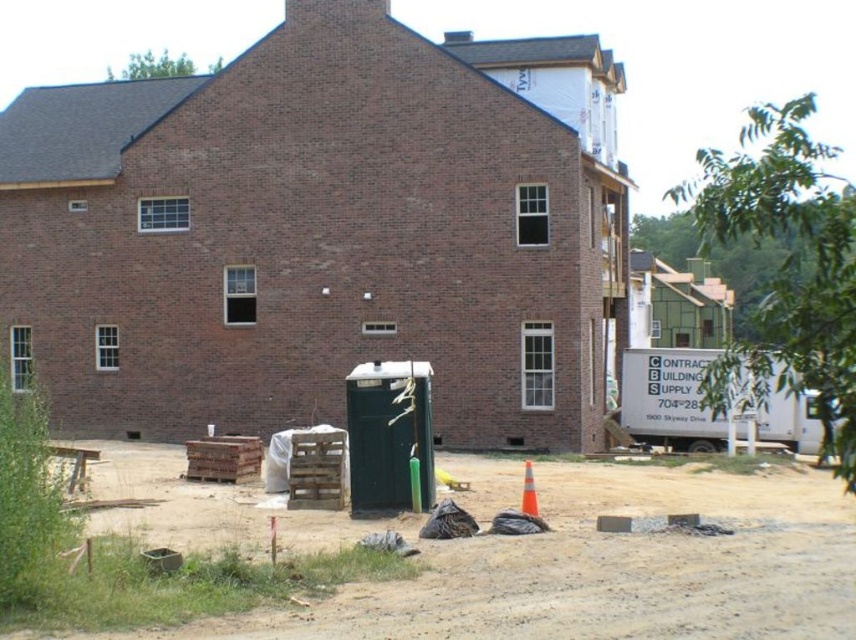
You are a delivery driver approaching the construction site in your 2.5 meter wide truck. You need to park near the dirt at lower center and orange reflective cone at lower center. Is there enough space between them to park your truck without hitting either object?

The dirt at lower center is larger in size than orange reflective cone at lower center. However, the exact distance between them isn

You are a delivery driver arriving at a construction site. You need to park your truck near the dirt at lower center without blocking the orange reflective cone at lower center. Can you fit the truck between them?

The dirt at lower center is wider than the orange reflective cone at lower center. Since the dirt is wider, there should be enough space to park the truck near the dirt without blocking the cone.